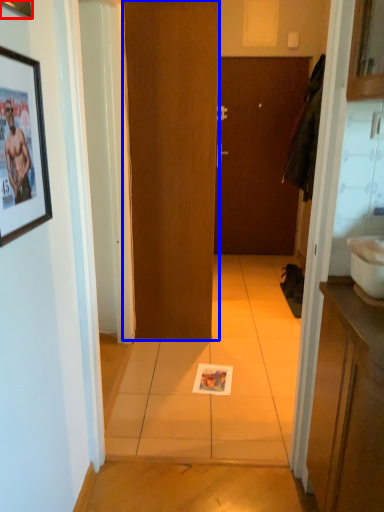
Question: Which of the following is the closest to the observer, picture frame (highlighted by a red box) or door (highlighted by a blue box)?

Choices:
 (A) picture frame
 (B) door

Answer: (A)